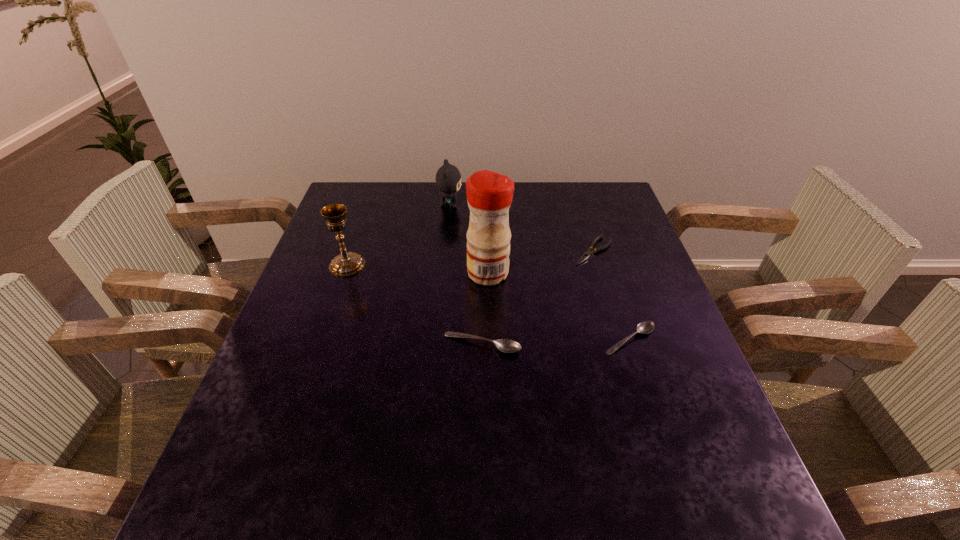
The height and width of the screenshot is (540, 960). Find the location of `vacant space located 0.390m on the back of the shorter soupspoon`. vacant space located 0.390m on the back of the shorter soupspoon is located at coordinates (593, 227).

This screenshot has width=960, height=540. I want to click on vacant space positioned 0.260m on the front-facing side of the fourth shortest object, so click(x=543, y=205).

This screenshot has width=960, height=540. I want to click on free space located 0.070m on the left of the pliers, so click(547, 251).

I want to click on vacant space located 0.130m on the front of the condiment, so click(490, 325).

Find the location of a particular element. vacant space located on the back of the leftmost object is located at coordinates (374, 185).

This screenshot has height=540, width=960. In order to click on object that is positioned at the far edge in this screenshot , I will do 448,178.

Where is `object present at the left edge`? object present at the left edge is located at coordinates (347, 263).

Where is `soupspoon that is at the right edge`? The width and height of the screenshot is (960, 540). soupspoon that is at the right edge is located at coordinates (645, 327).

Identify the location of pliers present at the right edge. (589, 252).

Where is `blank area at the far edge`? The height and width of the screenshot is (540, 960). blank area at the far edge is located at coordinates (510, 221).